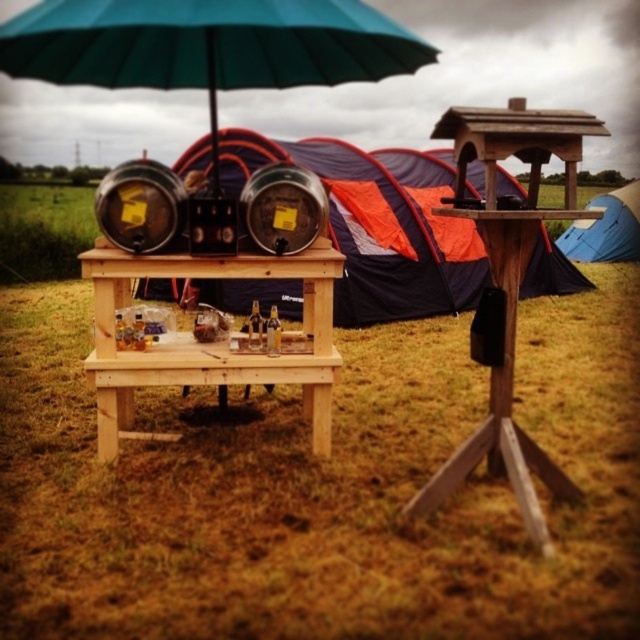
Which is behind, point (305, 83) or point (333, 298)?

Point (333, 298)

Consider the image. Does green fabric umbrella at upper center have a lesser height compared to orange fabric tent at center?

Indeed, green fabric umbrella at upper center has a lesser height compared to orange fabric tent at center.

This screenshot has width=640, height=640. What do you see at coordinates (208, 45) in the screenshot? I see `green fabric umbrella at upper center` at bounding box center [208, 45].

You are a GUI agent. You are given a task and a screenshot of the screen. Output one action in this format:
    pyautogui.click(x=<x>, y=<y>)
    Task: Click on the green fabric umbrella at upper center
    
    Given the screenshot: What is the action you would take?
    pyautogui.click(x=208, y=45)

Does green fabric umbrella at upper center have a smaller size compared to light brown wood picnic table at center?

No.

Is point (212, 138) farther from camera compared to point (109, 355)?

Yes, it is behind point (109, 355).

Where is `green fabric umbrella at upper center`? green fabric umbrella at upper center is located at coordinates (208, 45).

Is light brown wood picnic table at center closer to camera compared to blue fabric tent at right?

Yes, light brown wood picnic table at center is in front of blue fabric tent at right.

Between point (330, 362) and point (602, 221), which one is positioned in front?

Point (330, 362) is more forward.

You are a GUI agent. You are given a task and a screenshot of the screen. Output one action in this format:
    pyautogui.click(x=<x>, y=<y>)
    Task: Click on the light brown wood picnic table at center
    Image resolution: width=640 pixels, height=640 pixels.
    Given the screenshot: What is the action you would take?
    pyautogui.click(x=211, y=342)